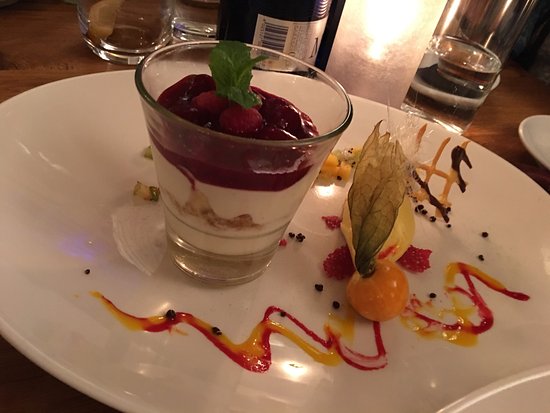
You are a GUI agent. You are given a task and a screenshot of the screen. Output one action in this format:
    pyautogui.click(x=<x>, y=<y>)
    Task: Click on the candle
    
    Given the screenshot: What is the action you would take?
    pyautogui.click(x=343, y=71)